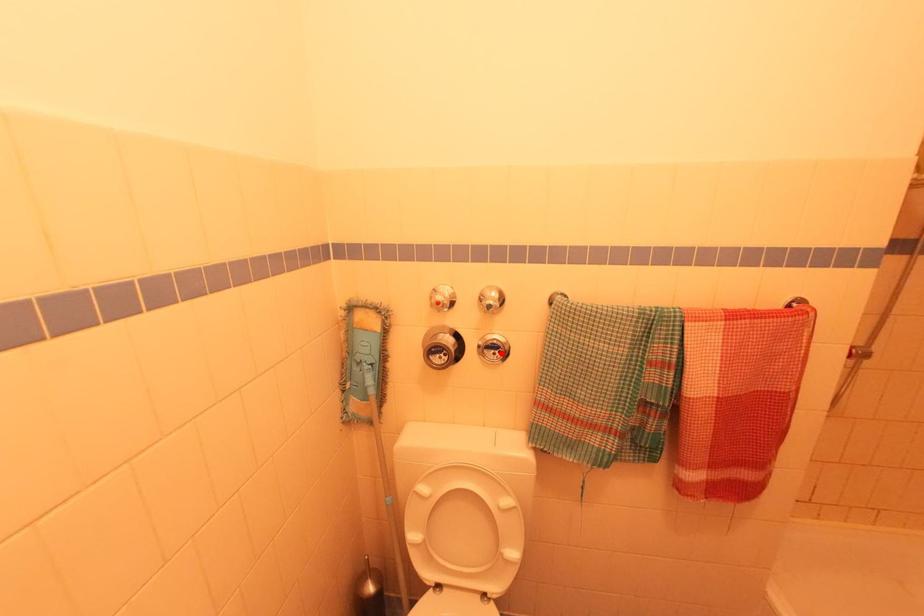
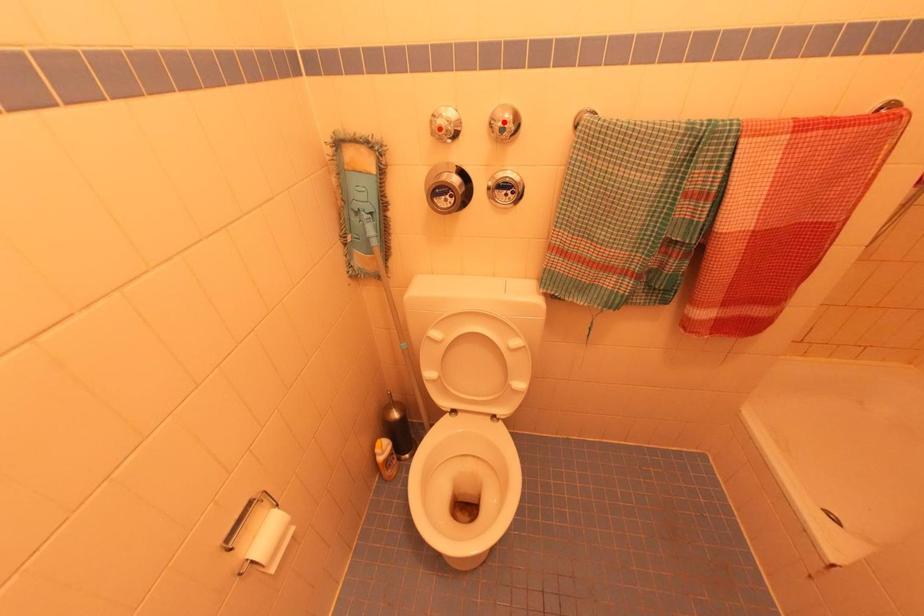
I am providing you with two images of the same scene from different viewpoints. A red point is marked on the first image and another point is marked on the second image. Is the marked point in image1 the same physical position as the marked point in image2?

No